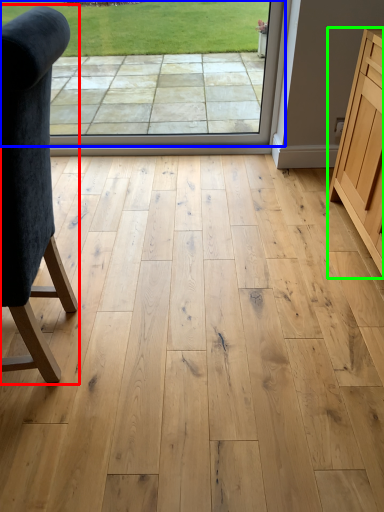
Question: Which object is positioned closest to chair (highlighted by a red box)? Select from window screen (highlighted by a blue box) and cabinetry (highlighted by a green box).

Choices:
 (A) window screen
 (B) cabinetry

Answer: (B)